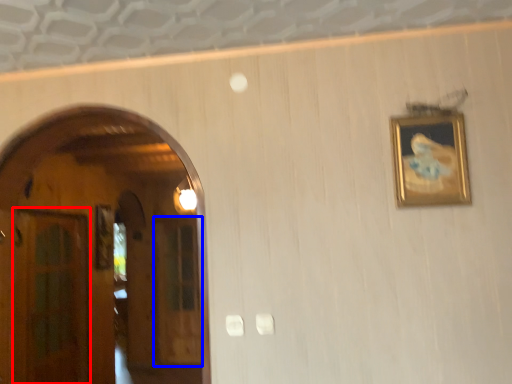
Question: Which of the following is the closest to the observer, glass door (highlighted by a red box) or glass door (highlighted by a blue box)?

Choices:
 (A) glass door
 (B) glass door

Answer: (A)